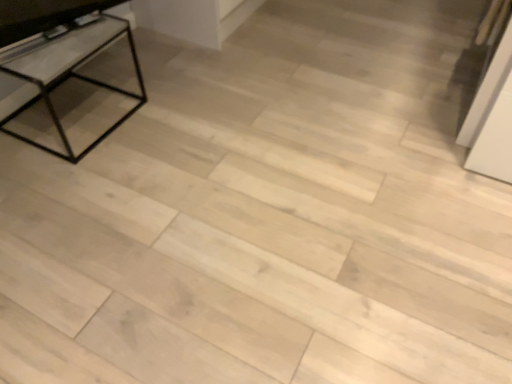
What is the approximate height of clear glass coffee table at left?

15.82 inches.

Identify the location of clear glass coffee table at left. (66, 67).

What do you see at coordinates (66, 67) in the screenshot?
I see `clear glass coffee table at left` at bounding box center [66, 67].

Locate an element on the screen. This screenshot has width=512, height=384. clear glass coffee table at left is located at coordinates 66,67.